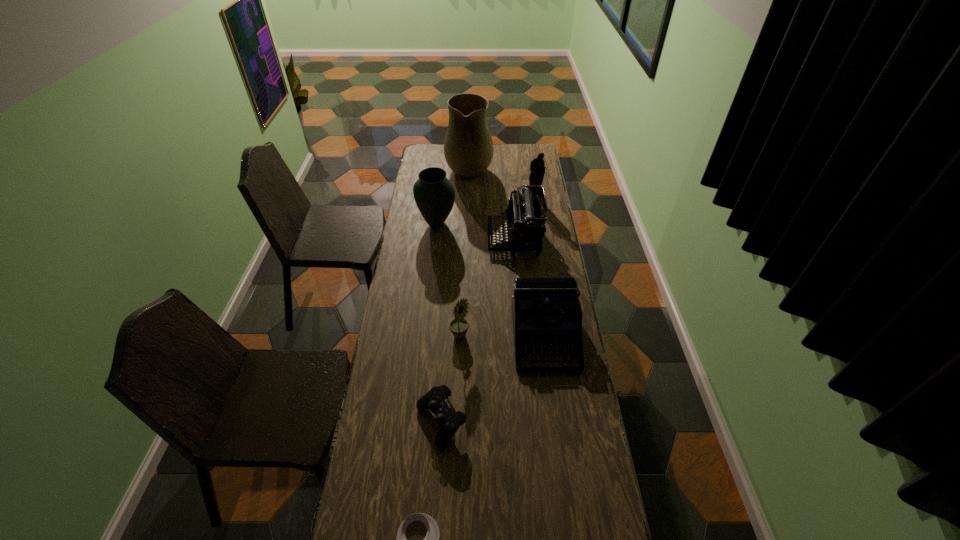
I want to click on free spot located 0.250m at the spout of the farthest object, so click(x=536, y=166).

You are a GUI agent. You are given a task and a screenshot of the screen. Output one action in this format:
    pyautogui.click(x=<x>, y=<y>)
    Task: Click on the free space located 0.340m on the back of the vase
    This screenshot has height=540, width=960.
    Given the screenshot: What is the action you would take?
    pyautogui.click(x=442, y=179)

At what (x,y) coordinates should I click in order to perform the action: click on vacant space situated 0.250m on the front-facing side of the figurine. Please return your answer as a coordinate pair (x, y). The height and width of the screenshot is (540, 960). Looking at the image, I should click on (540, 230).

In order to click on free space located 0.220m on the typing side of the farther typewriter in this screenshot , I will do coord(442,238).

Identify the location of free space located on the typing side of the farther typewriter. The height and width of the screenshot is (540, 960). (436, 238).

Where is `free location located 0.310m on the typing side of the farther typewriter`? The height and width of the screenshot is (540, 960). free location located 0.310m on the typing side of the farther typewriter is located at coordinates (423, 238).

You are a GUI agent. You are given a task and a screenshot of the screen. Output one action in this format:
    pyautogui.click(x=<x>, y=<y>)
    Task: Click on the vacant space situated 0.110m on the face of the sunflower
    
    Given the screenshot: What is the action you would take?
    pyautogui.click(x=498, y=336)

Where is `vacant region located 0.180m on the typing side of the shorter typewriter`? The width and height of the screenshot is (960, 540). vacant region located 0.180m on the typing side of the shorter typewriter is located at coordinates (555, 420).

Find the location of a particular element. This screenshot has height=540, width=960. free spot located 0.190m on the front of the second nearest object is located at coordinates (435, 518).

The image size is (960, 540). Identify the location of object located at the far edge. (468, 147).